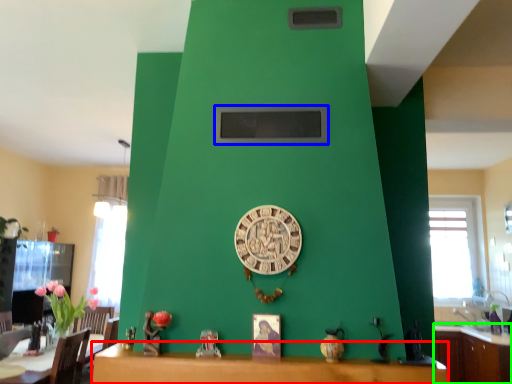
Question: Considering the real-world distances, which object is closest to table (highlighted by a red box)? window screen (highlighted by a blue box) or cabinetry (highlighted by a green box).

Choices:
 (A) window screen
 (B) cabinetry

Answer: (A)